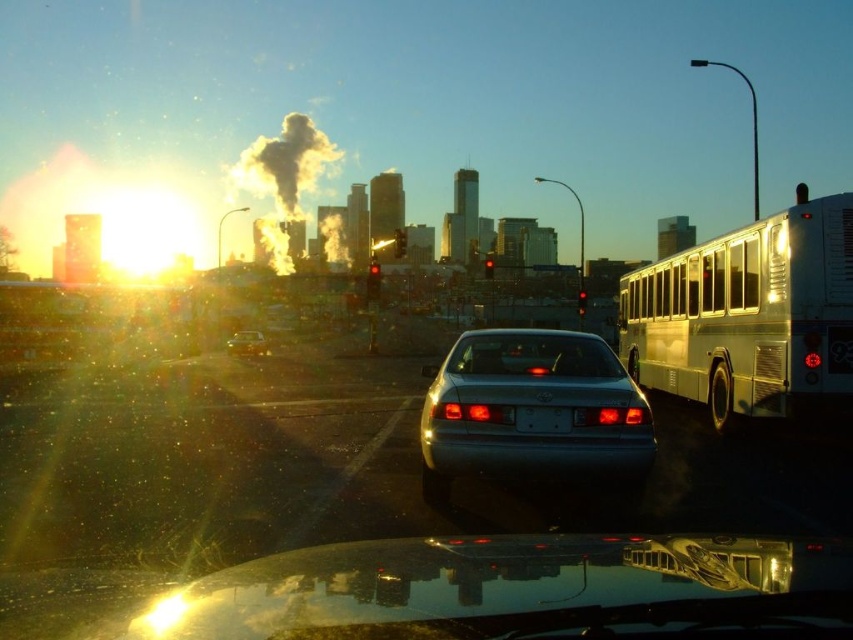
Consider the image. You are standing in front of the cityscape at sunrise or sunset. There are two points in the image labeled as point 1 at coordinates (527, 349) and point 2 at coordinates (262, 337). Which point is closer to you?

Point 1 at coordinates (527, 349) is closer to you than point 2 at coordinates (262, 337).

You are standing in front of the cityscape scene. There are two points marked in the image. The first point is at coordinates point (x=775, y=276) and the second is at point (x=283, y=211). Which point is closer to you?

Point (x=775, y=276) is closer to the camera than point (x=283, y=211).

You are standing at the point with coordinates (283, 182) in the cityscape image. What is the nearest object to you?

The nearest object to you is the gray smoky plume at center, as the point is located on it.